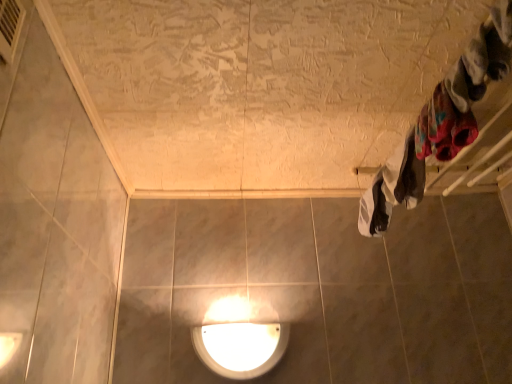
Question: In terms of width, does metallic silver air conditioner at upper left look wider or thinner when compared to white cotton towel at right, placed as the 1th clothing when sorted from bottom to top?

Choices:
 (A) wide
 (B) thin

Answer: (B)

Question: Based on their sizes in the image, would you say metallic silver air conditioner at upper left is bigger or smaller than white cotton towel at right, marked as the third clothing in a front-to-back arrangement?

Choices:
 (A) big
 (B) small

Answer: (B)

Question: Based on their relative distances, which object is farther from the multicolored fabric at upper right, marked as the second clothing in a front-to-back arrangement?

Choices:
 (A) white glossy lamp at lower center
 (B) fluffy white socks at upper right, which is the 1th clothing in top-to-bottom order
 (C) white cotton towel at right, marked as the third clothing in a front-to-back arrangement
 (D) metallic silver air conditioner at upper left

Answer: (D)

Question: Which object is positioned farthest from the white cotton towel at right, placed as the 1th clothing when sorted from bottom to top?

Choices:
 (A) fluffy white socks at upper right, positioned as the 1th clothing in front-to-back order
 (B) multicolored fabric at upper right, marked as the second clothing in a front-to-back arrangement
 (C) metallic silver air conditioner at upper left
 (D) white glossy lamp at lower center

Answer: (C)